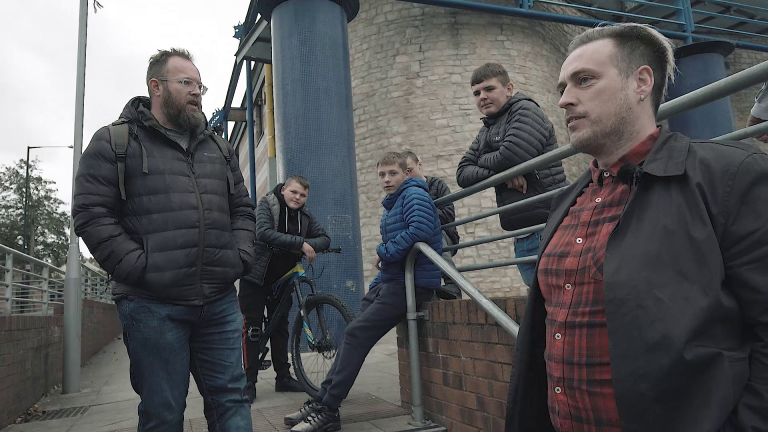
At what (x,y) coordinates should I click in order to perform the action: click on brick wall. Please return your answer as a coordinate pair (x, y). The width and height of the screenshot is (768, 432). Looking at the image, I should click on (394, 92).